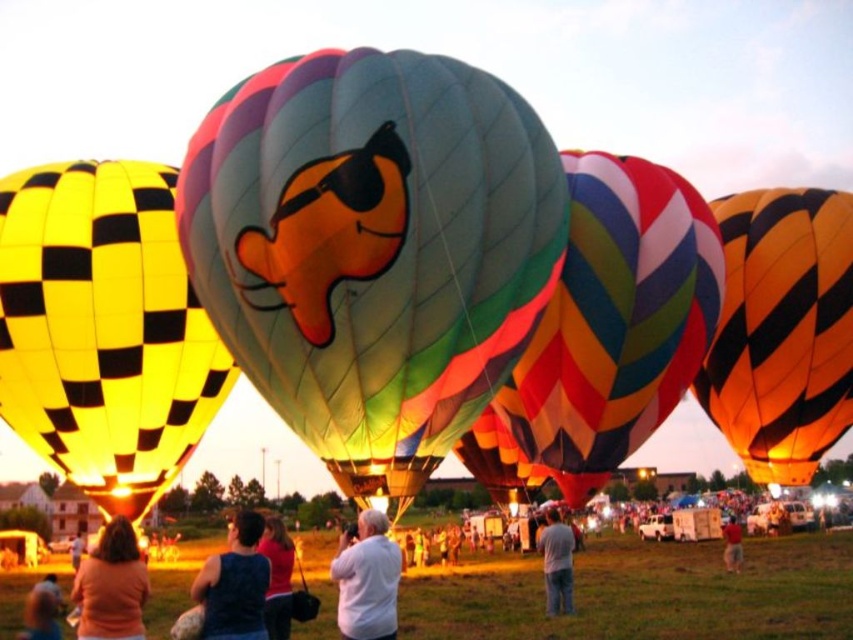
In the scene shown: You are standing at the center of the hot air balloon festival. You see two points marked in the image. One is at coordinates point (96, 570) and the other at point (730, 528). Which point is closer to you?

Point (96, 570) is closer to the viewer than point (730, 528).

You are an observer at the hot air balloon festival. You notice two balloons at the center of the scene. The multicolored fabric balloon at center and the multicolored striped fabric hot air balloon at center. Which of these two balloons is smaller in size?

The multicolored fabric balloon at center has a smaller size compared to the multicolored striped fabric hot air balloon at center, so the multicolored fabric balloon at center is the smaller one.

You are a photographer at the hot air balloon festival. You want to capture a photo that includes both the orange cotton shirt at lower left and the red shirt at center. Which shirt should you focus on first to ensure both are in frame?

The orange cotton shirt at lower left is positioned over the red shirt at center, so you should focus on the orange cotton shirt at lower left first to ensure both are in frame.